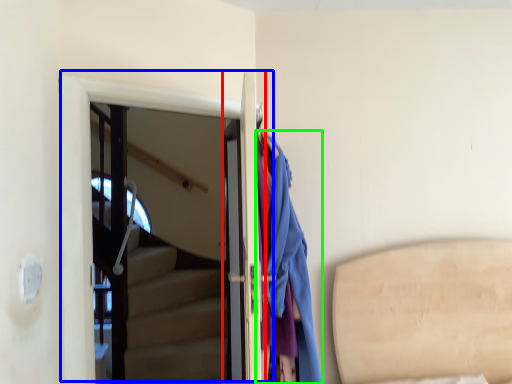
Question: Estimate the real-world distances between objects in this image. Which object is closer to door (highlighted by a red box), door (highlighted by a blue box) or clothing (highlighted by a green box)?

Choices:
 (A) door
 (B) clothing

Answer: (B)